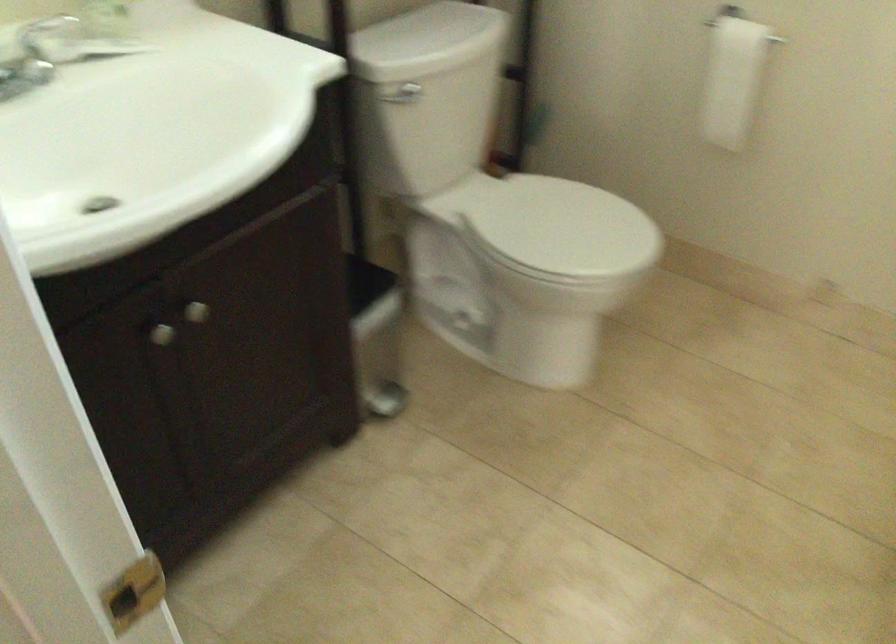
At what (x,y) coordinates should I click in order to perform the action: click on toilet flush handle. Please return your answer as a coordinate pair (x, y). This screenshot has width=896, height=644. Looking at the image, I should click on (405, 93).